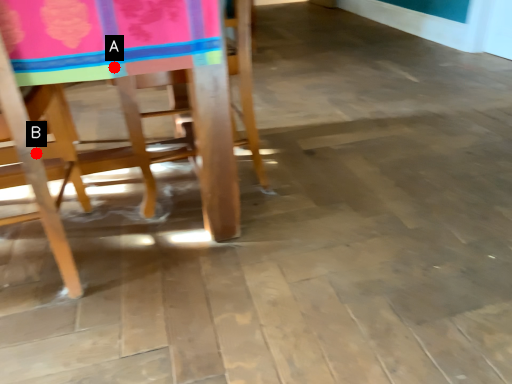
Question: Two points are circled on the image, labeled by A and B beside each circle. Which point is closer to the camera taking this photo?

Choices:
 (A) A is closer
 (B) B is closer

Answer: (A)